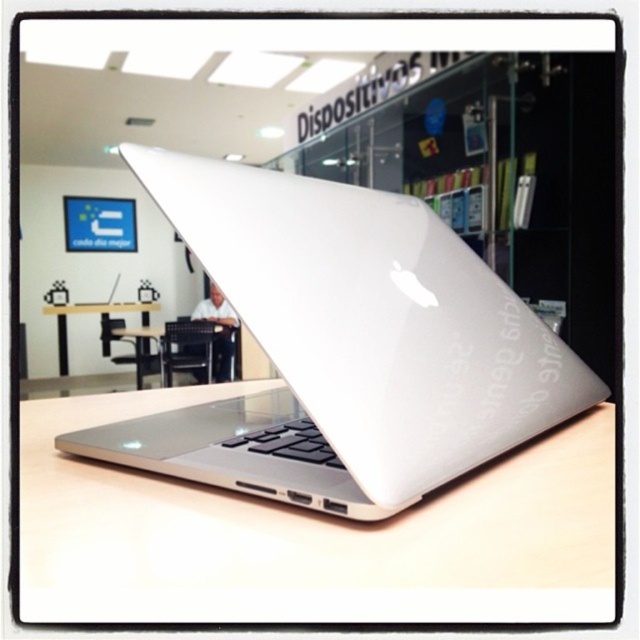
Question: Among these objects, which one is nearest to the camera?

Choices:
 (A) black plastic table at center
 (B) silver metallic laptop at center
 (C) white glossy table at center

Answer: (B)

Question: Among these objects, which one is nearest to the camera?

Choices:
 (A) transparent plastic bookshelf at center
 (B) black plastic table at center

Answer: (A)

Question: From the image, what is the correct spatial relationship of white matte table at center in relation to transparent plastic bookshelf at center?

Choices:
 (A) above
 (B) below

Answer: (B)

Question: Can you confirm if white matte table at center is smaller than white glossy table at center?

Choices:
 (A) yes
 (B) no

Answer: (B)

Question: Which object is positioned farthest from the white glossy table at center?

Choices:
 (A) transparent plastic bookshelf at center
 (B) white matte table at center
 (C) black plastic table at center

Answer: (B)

Question: Can you confirm if silver metallic laptop at center is positioned to the right of black plastic table at center?

Choices:
 (A) yes
 (B) no

Answer: (A)